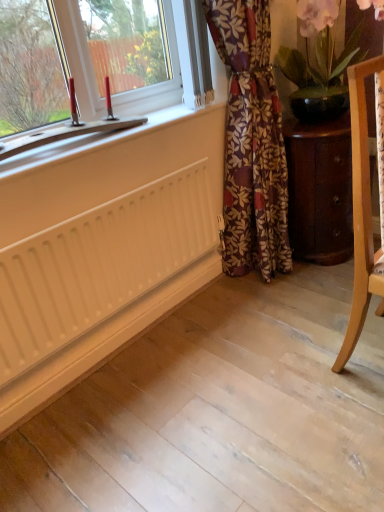
At what (x,y) coordinates should I click in order to perform the action: click on free point below white matte radiator at lower left (from a real-world perspective). Please return your answer as a coordinate pair (x, y). The width and height of the screenshot is (384, 512). Looking at the image, I should click on (101, 377).